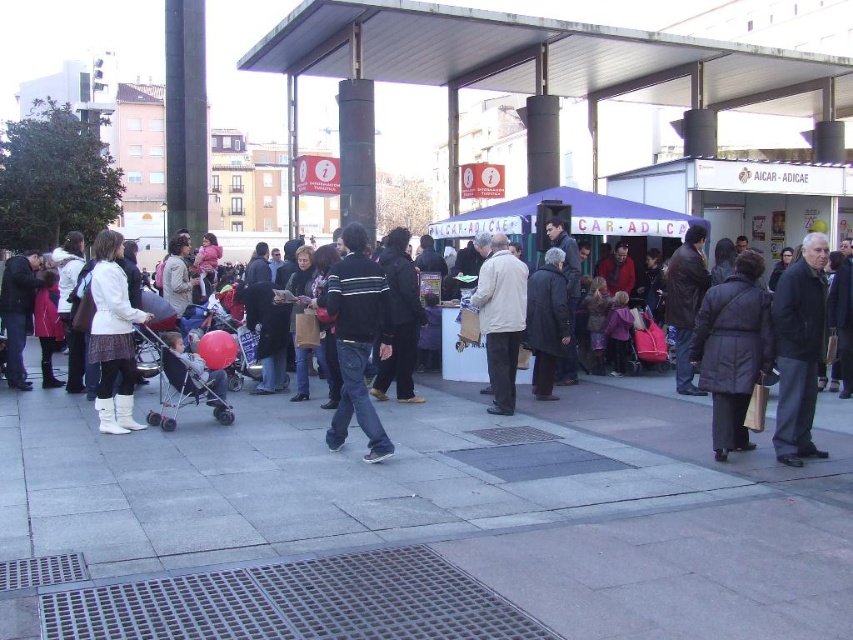
Is point (772, 467) farther from viewer compared to point (556, 292)?

That is False.

Is dark brown leather boots at center further to camera compared to dark gray coat at center?

No, it is in front of dark gray coat at center.

Which is in front, point (827, 426) or point (566, 339)?

Point (827, 426) is in front.

The image size is (853, 640). I want to click on dark brown leather boots at center, so click(x=630, y=413).

Between point (735, 316) and point (155, 413), which one is positioned behind?

The point (155, 413) is more distant.

Does dark gray puffer coat at center have a lesser width compared to matte plastic baby carriage at left?

Yes.

The width and height of the screenshot is (853, 640). In order to click on dark gray puffer coat at center in this screenshot , I will do `click(732, 349)`.

Is dark brown leather boots at center bigger than matte plastic baby carriage at left?

Yes.

Who is positioned more to the left, dark brown leather boots at center or matte plastic baby carriage at left?

Positioned to the left is matte plastic baby carriage at left.

The width and height of the screenshot is (853, 640). What do you see at coordinates (630, 413) in the screenshot? I see `dark brown leather boots at center` at bounding box center [630, 413].

Where is `dark brown leather boots at center`? dark brown leather boots at center is located at coordinates (630, 413).